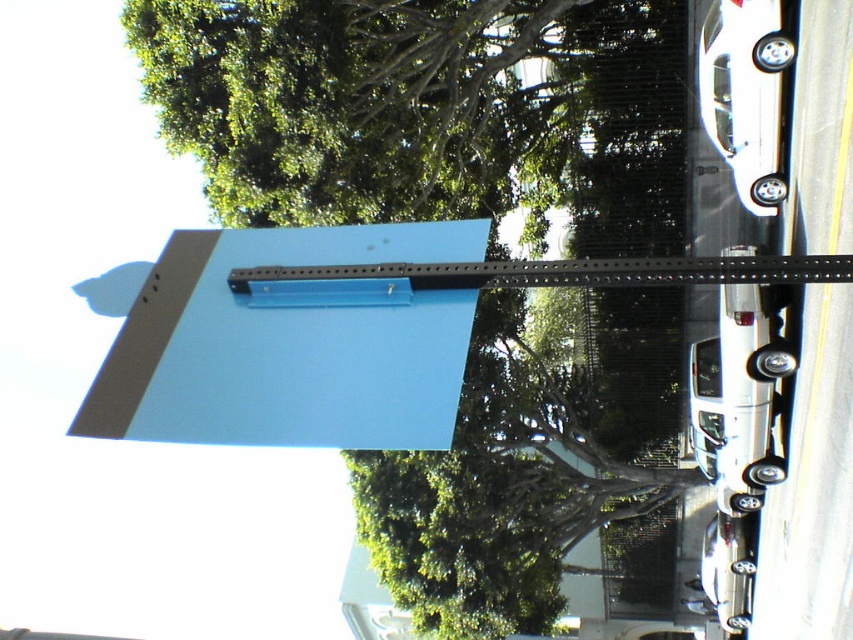
Question: Is blue matte sign at upper center below black plastic pole at center?

Choices:
 (A) no
 (B) yes

Answer: (B)

Question: Which of the following is the farthest from the observer?

Choices:
 (A) black plastic pole at center
 (B) green leafy tree at upper center

Answer: (A)

Question: Considering the relative positions of green leafy tree at upper center and blue matte sign at upper center in the image provided, where is green leafy tree at upper center located with respect to blue matte sign at upper center?

Choices:
 (A) left
 (B) right

Answer: (A)

Question: Can you confirm if blue matte sign at upper center is bigger than black plastic pole at center?

Choices:
 (A) no
 (B) yes

Answer: (B)

Question: Which object appears closest to the camera in this image?

Choices:
 (A) blue matte sign at upper center
 (B) black plastic pole at center

Answer: (A)

Question: Which of these objects is positioned closest to the blue matte sign at upper center?

Choices:
 (A) green leafy tree at upper center
 (B) black plastic pole at center

Answer: (B)